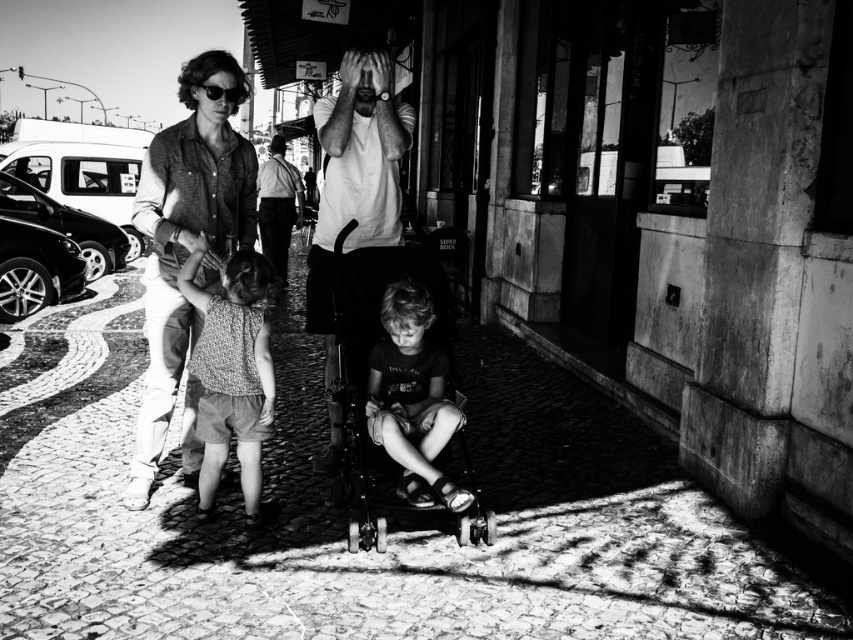
Question: Is the position of cobblestone pavement at lower center more distant than that of knitted fabric dress at center?

Choices:
 (A) yes
 (B) no

Answer: (B)

Question: Can you confirm if knitted fabric dress at center is positioned to the left of smooth black shirt at center?

Choices:
 (A) yes
 (B) no

Answer: (A)

Question: Which point is farther to the camera?

Choices:
 (A) smooth black shirt at center
 (B) smooth white shirt at center

Answer: (B)

Question: Is white matte t-shirt at center wider than smooth white shirt at center?

Choices:
 (A) yes
 (B) no

Answer: (B)

Question: Considering the real-world distances, which object is farthest from the shiny black sunglasses at upper left?

Choices:
 (A) smooth white shirt at center
 (B) metallic stroller at center

Answer: (A)

Question: Among these objects, which one is farthest from the camera?

Choices:
 (A) smooth white shirt at center
 (B) smooth black shirt at center
 (C) shiny black sunglasses at upper left
 (D) cobblestone pavement at lower center

Answer: (A)